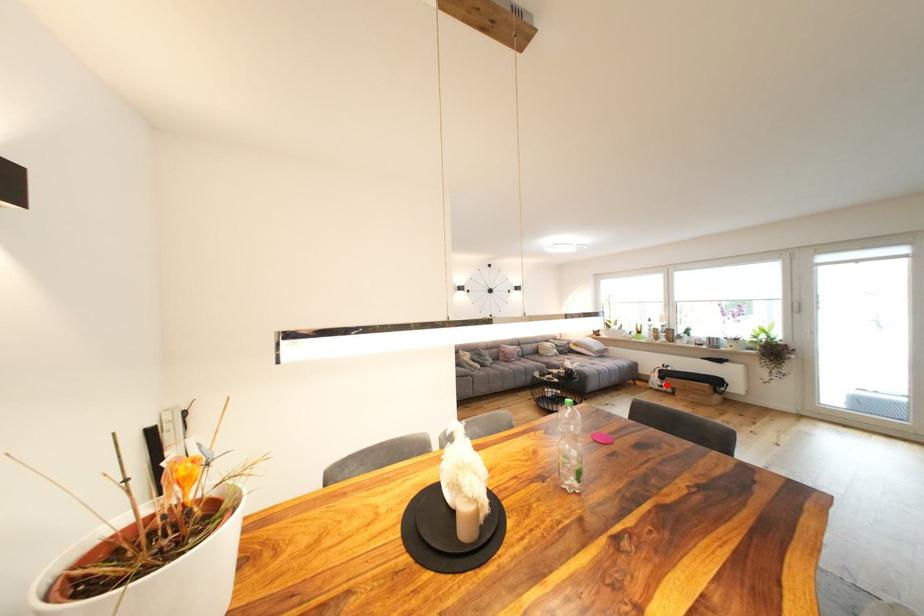
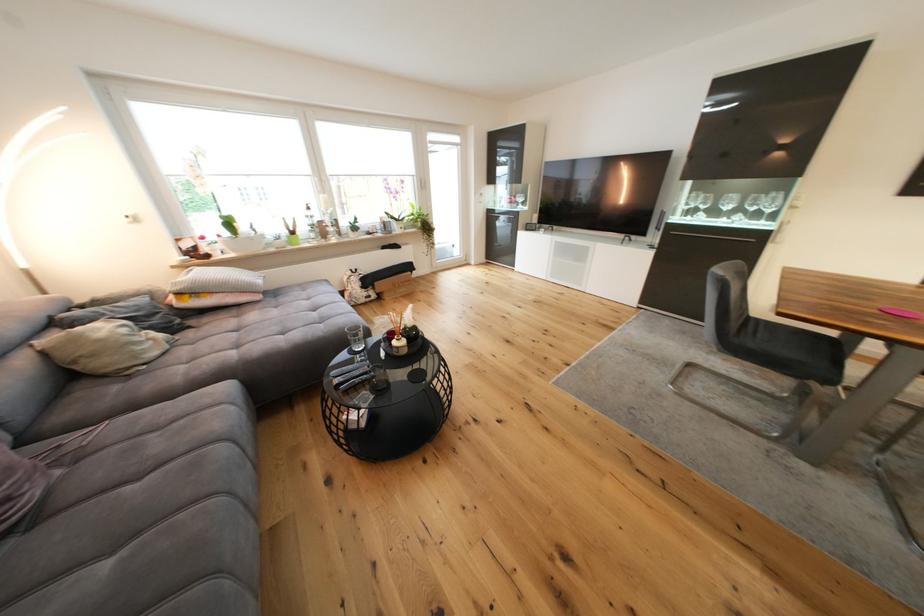
In the second image, find the point that corresponds to the highlighted location in the first image.

(372, 296)